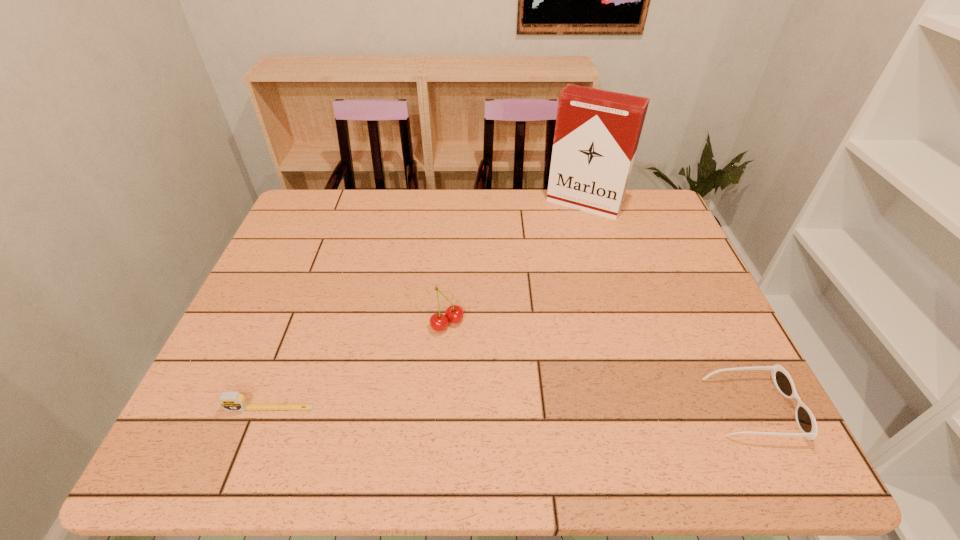
Identify the location of free spot located 0.150m with the stems of the third shortest object pointing upwards. The image size is (960, 540). (495, 375).

Locate an element on the screen. vacant area located with the stems of the third shortest object pointing upwards is located at coordinates (503, 384).

Find the location of a particular element. The image size is (960, 540). object positioned at the far edge is located at coordinates (597, 132).

The width and height of the screenshot is (960, 540). In order to click on tape measure that is positioned at the near edge in this screenshot , I will do `click(230, 401)`.

This screenshot has width=960, height=540. Find the location of `sunglasses present at the near edge`. sunglasses present at the near edge is located at coordinates (806, 422).

Where is `object present at the left edge`? The height and width of the screenshot is (540, 960). object present at the left edge is located at coordinates (230, 401).

Find the location of a particular element. The height and width of the screenshot is (540, 960). sunglasses that is at the right edge is located at coordinates (806, 422).

Locate an element on the screen. Image resolution: width=960 pixels, height=540 pixels. cigarette_case present at the right edge is located at coordinates (597, 132).

The width and height of the screenshot is (960, 540). In order to click on object situated at the near left corner in this screenshot , I will do `click(230, 401)`.

What are the coordinates of `object at the far right corner` in the screenshot? It's located at (597, 132).